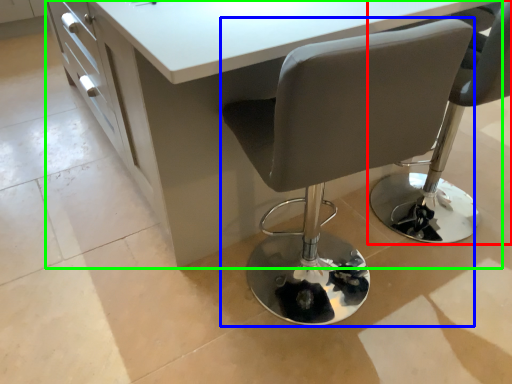
Question: Which is farther away from chair (highlighted by a red box)? chair (highlighted by a blue box) or table (highlighted by a green box)?

Choices:
 (A) chair
 (B) table

Answer: (A)